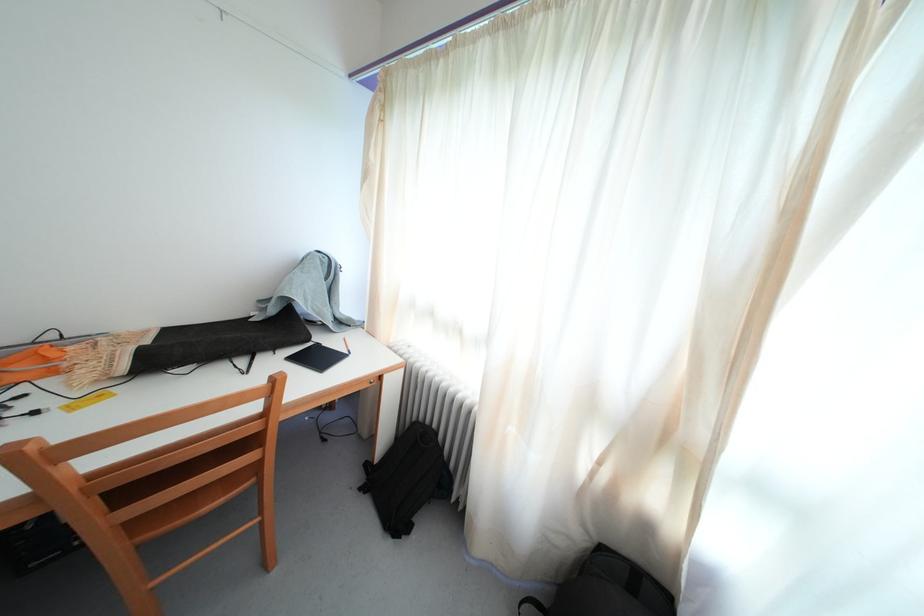
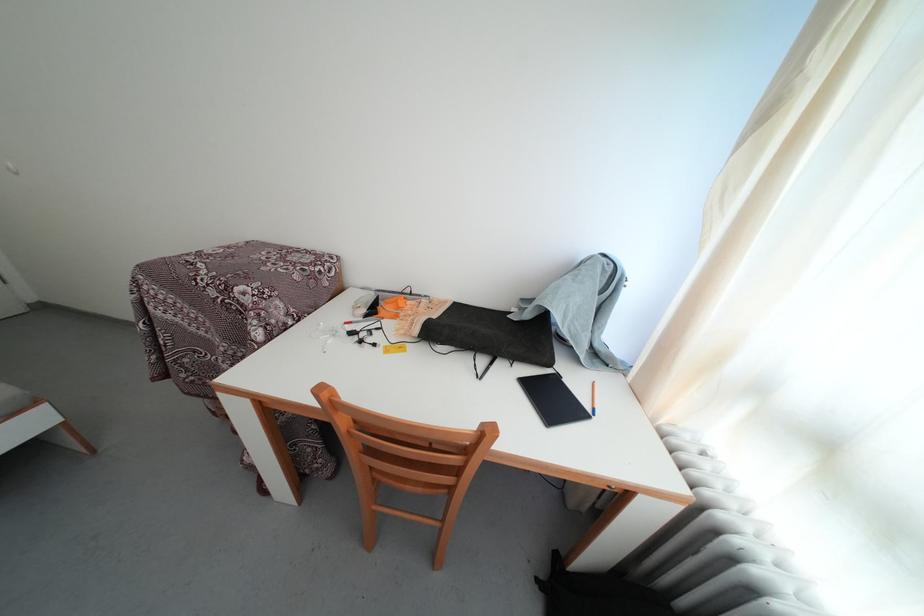
The point at (323,351) is marked in the first image. Where is the corresponding point in the second image?

(564, 383)